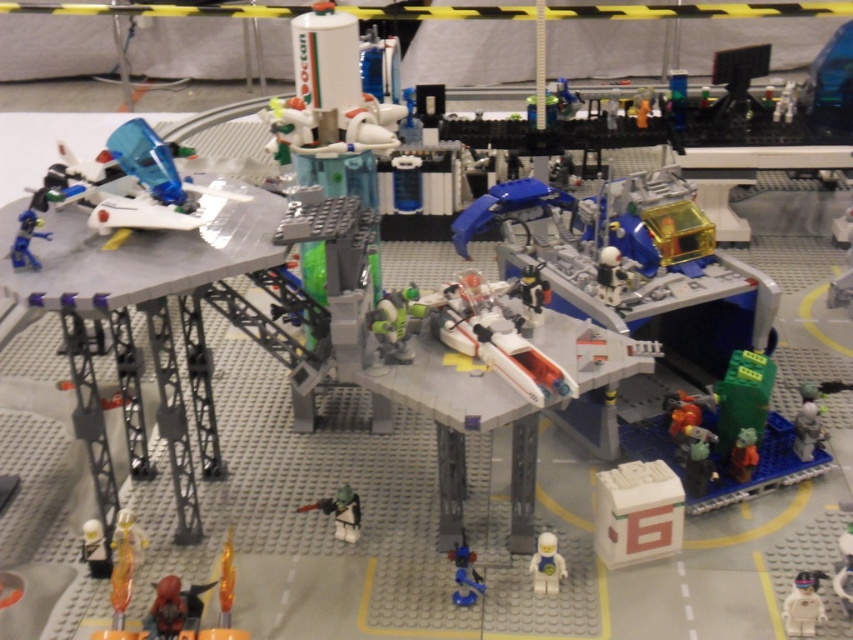
Based on the photo, is shiny blue spaceship at upper left to the left of green matte figure at lower right from the viewer's perspective?

Indeed, shiny blue spaceship at upper left is positioned on the left side of green matte figure at lower right.

Can you confirm if shiny blue spaceship at upper left is thinner than green matte figure at lower right?

Correct, shiny blue spaceship at upper left's width is less than green matte figure at lower right's.

Is point (22, 264) closer to viewer compared to point (729, 468)?

That is True.

The height and width of the screenshot is (640, 853). Identify the location of shiny blue spaceship at upper left. (26, 240).

Can you confirm if white matte helmet at center is wider than shiny silver figure at lower left?

Yes.

Which is in front, point (354, 536) or point (90, 538)?

Point (90, 538) is in front.

Which is behind, point (345, 522) or point (85, 538)?

Point (345, 522)

Find the location of a particular element. white matte helmet at center is located at coordinates (340, 513).

Measure the distance between shiny silver figure at lower left and green matte figure at lower right.

shiny silver figure at lower left is 1.01 meters away from green matte figure at lower right.

Is shiny silver figure at lower left to the right of green matte figure at lower right from the viewer's perspective?

No, shiny silver figure at lower left is not to the right of green matte figure at lower right.

Locate an element on the screen. The height and width of the screenshot is (640, 853). shiny silver figure at lower left is located at coordinates (96, 548).